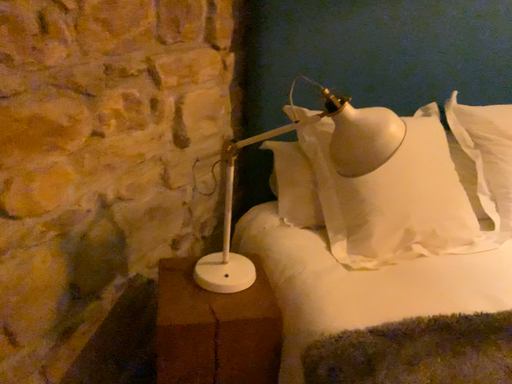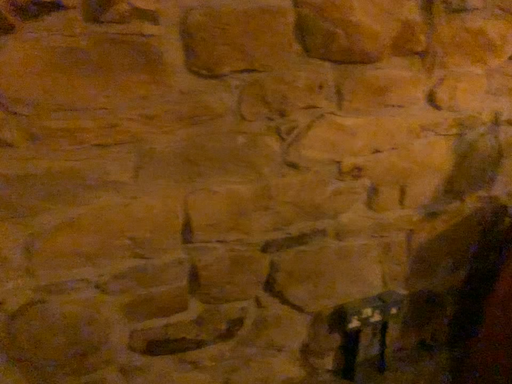
Question: Which way did the camera rotate in the video?

Choices:
 (A) rotated right
 (B) rotated left

Answer: (B)